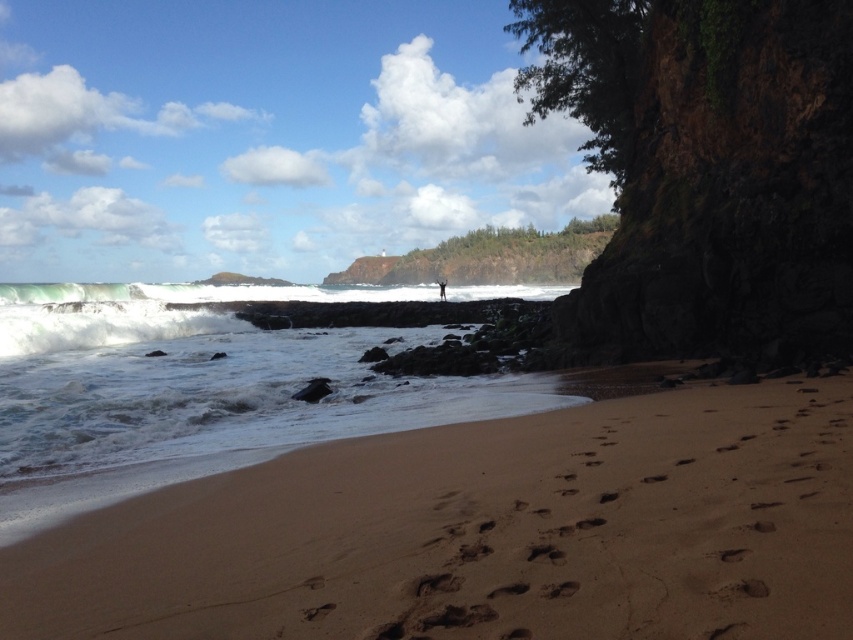
You are standing at the point marked as point (485, 532) and want to walk to the rocky shoreline. Which direction should you move relative to your current position?

The sandy beach at lower left is located at point (485, 532). To reach the rocky shoreline, you should move towards the upper right direction from your current position.

You are standing on the rocky shoreline and see both the sandy beach at lower left and the white frothy water at lower left. Which one is positioned to the right when viewed from your current location?

The sandy beach at lower left is positioned to the right of the white frothy water at lower left.